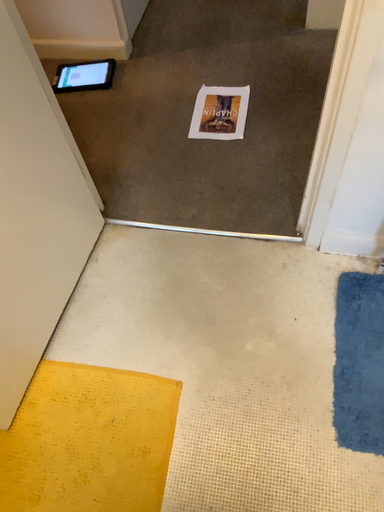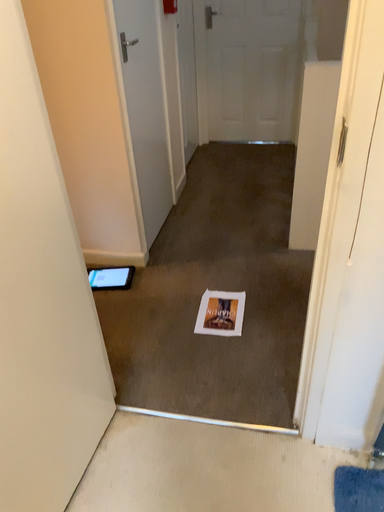
Question: How did the camera likely rotate when shooting the video?

Choices:
 (A) rotated upward
 (B) rotated downward

Answer: (A)